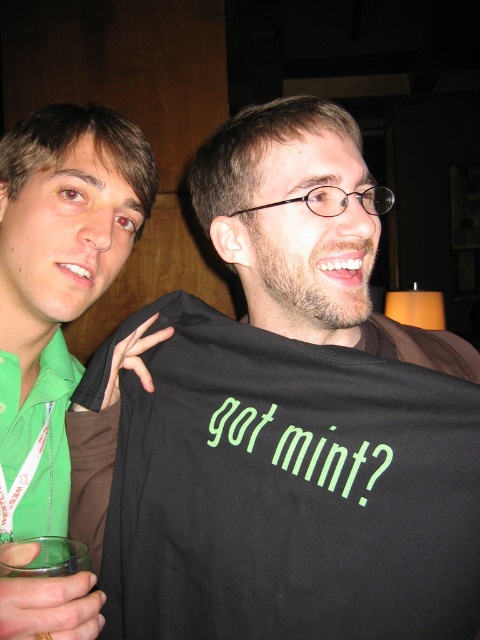
Is black fabric shirt at center above green fabric shirt at left?

No.

Can you confirm if black fabric shirt at center is positioned below green fabric shirt at left?

Correct, black fabric shirt at center is located below green fabric shirt at left.

This screenshot has width=480, height=640. What are the coordinates of `black fabric shirt at center` in the screenshot? It's located at (280, 420).